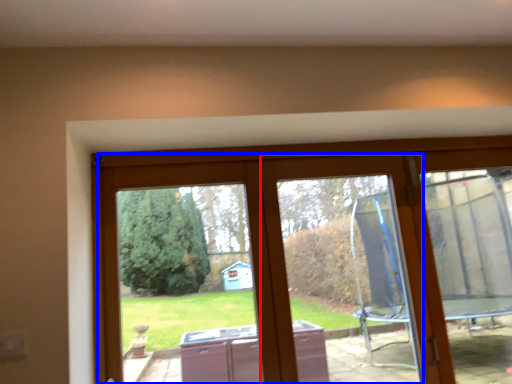
Question: Among these objects, which one is nearest to the camera, window frame (highlighted by a red box) or glass door (highlighted by a blue box)?

Choices:
 (A) window frame
 (B) glass door

Answer: (B)